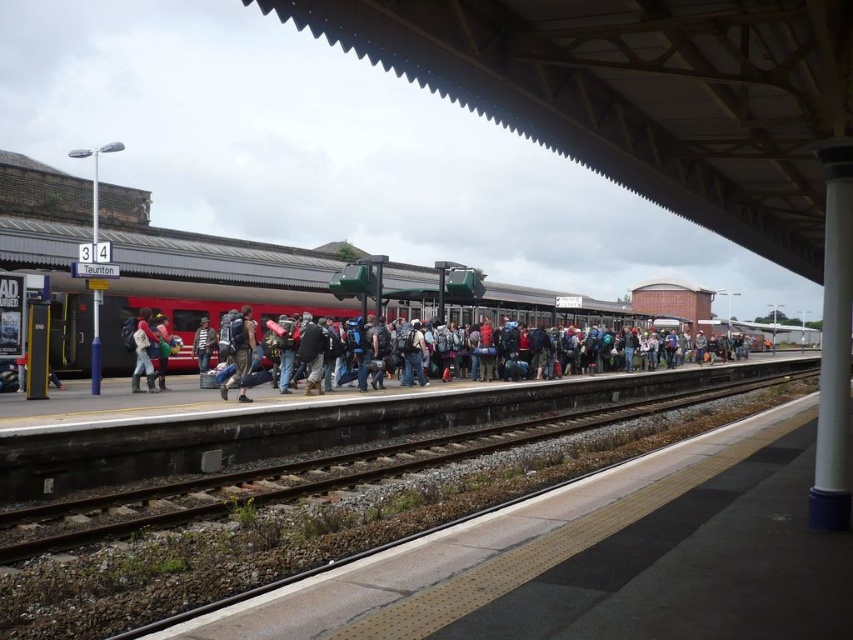
Question: Can you confirm if camouflage fabric backpack at center is wider than matte black backpack at center?

Choices:
 (A) yes
 (B) no

Answer: (A)

Question: Which point is farther from the camera taking this photo?

Choices:
 (A) (199, 352)
 (B) (143, 355)

Answer: (A)

Question: Can you confirm if camouflage fabric backpack at center is positioned above striped sweater at center?

Choices:
 (A) yes
 (B) no

Answer: (A)

Question: Which object is farther from the camera taking this photo?

Choices:
 (A) striped sweater at center
 (B) green fabric backpack at center
 (C) matte black backpack at center

Answer: (A)

Question: Does matte black backpack at center have a larger size compared to striped sweater at center?

Choices:
 (A) yes
 (B) no

Answer: (A)

Question: Among these points, which one is nearest to the camera?

Choices:
 (A) (206, 340)
 (B) (136, 332)
 (C) (157, 348)

Answer: (B)